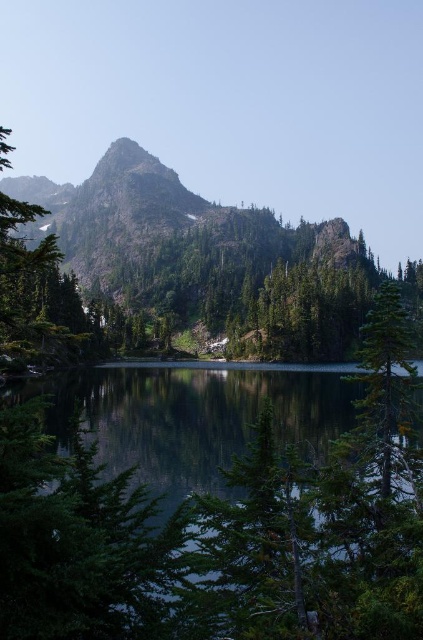
Question: Which object appears farthest from the camera in this image?

Choices:
 (A) green reflective water at center
 (B) green matte tree at right

Answer: (B)

Question: Does green reflective water at center have a larger size compared to green matte tree at right?

Choices:
 (A) yes
 (B) no

Answer: (B)

Question: Which of the following is the farthest from the observer?

Choices:
 (A) green matte tree at right
 (B) green reflective water at center

Answer: (A)

Question: Does green reflective water at center have a lesser width compared to green matte tree at right?

Choices:
 (A) no
 (B) yes

Answer: (A)

Question: Which point is farther to the camera?

Choices:
 (A) (147, 552)
 (B) (365, 353)

Answer: (B)

Question: Is green reflective water at center below green matte tree at right?

Choices:
 (A) yes
 (B) no

Answer: (A)